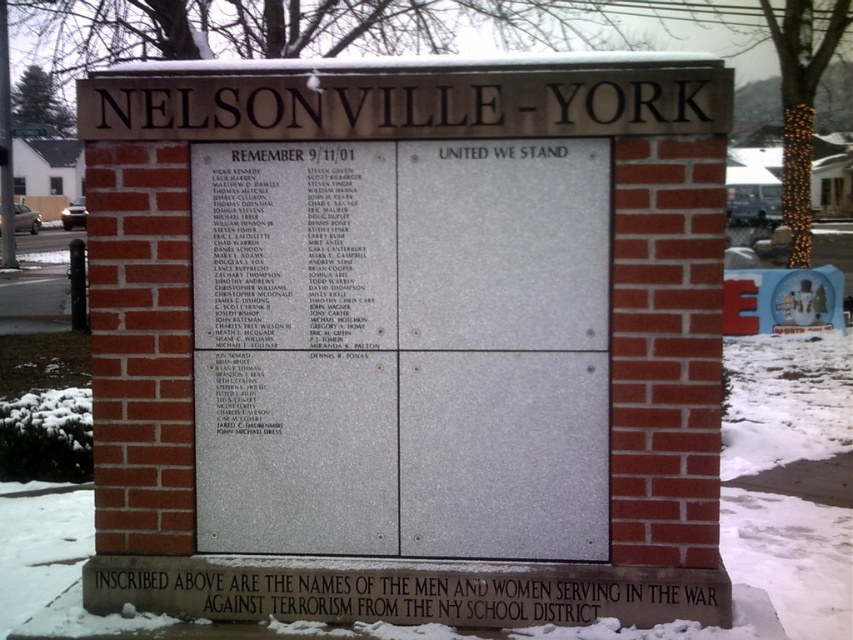
You are a photographer trying to capture the memorial monument. You want to ensure both the black polished stone plaque at center and the white powdery snow at lower center are clearly visible in your photo. Considering their sizes, which object should you focus on first to ensure proper framing?

The black polished stone plaque at center has a lesser width compared to the white powdery snow at lower center. To ensure proper framing, focus on the black polished stone plaque at center first as it is smaller and requires precise positioning to fit within the frame.

You are a maintenance worker tasked with cleaning the memorial. You need to reach both the black polished stone plaque at center and the white powdery snow at lower center. Given that your cleaning tool can only extend 1 meter, can you clean both areas without moving your position?

The black polished stone plaque at center is 1.28 meters from the white powdery snow at lower center. Since your tool can only extend 1 meter, you cannot reach both areas simultaneously without moving your position.